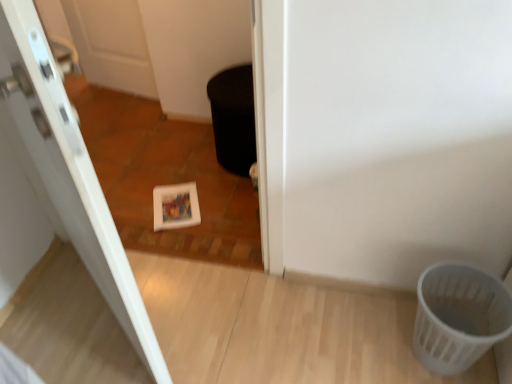
At what (x,y) coordinates should I click in order to perform the action: click on vacant region to the left of white glossy door at upper left. Please return your answer as a coordinate pair (x, y). Looking at the image, I should click on (62, 316).